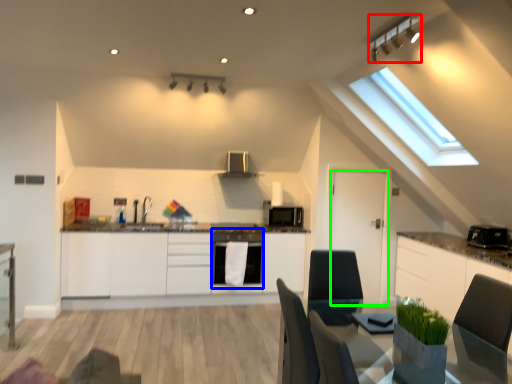
Question: Which object is positioned closest to light fixture (highlighted by a red box)? Select from dish washer (highlighted by a blue box) and door (highlighted by a green box).

Choices:
 (A) dish washer
 (B) door

Answer: (B)